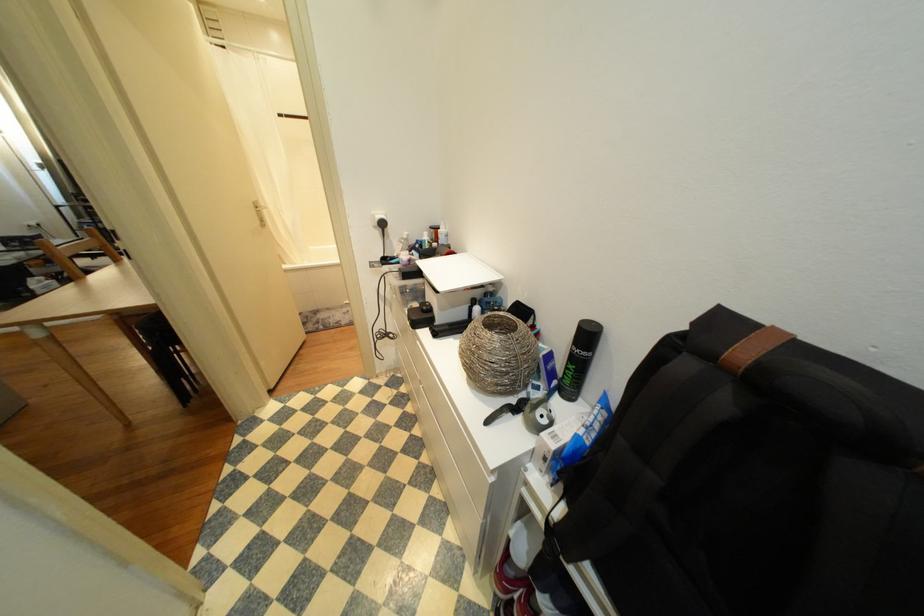
Find the location of `red shoe`. red shoe is located at coordinates (512, 589).